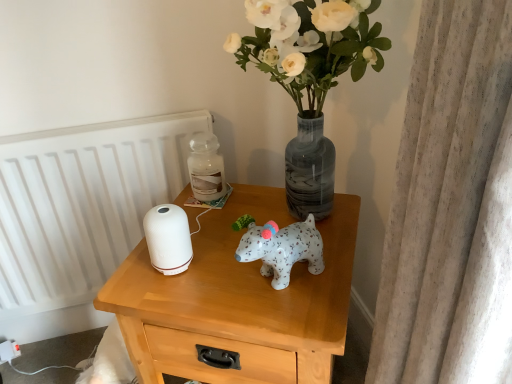
Question: Should I look upward or downward to see white glossy radiator at left?

Choices:
 (A) down
 (B) up

Answer: (A)

Question: Is white matte nightstand at center turned away from white matte vase at upper center?

Choices:
 (A) no
 (B) yes

Answer: (A)

Question: Is white matte nightstand at center oriented towards white matte vase at upper center?

Choices:
 (A) no
 (B) yes

Answer: (A)

Question: Considering the relative sizes of white matte nightstand at center and white matte vase at upper center in the image provided, is white matte nightstand at center thinner than white matte vase at upper center?

Choices:
 (A) yes
 (B) no

Answer: (B)

Question: Considering the relative sizes of white matte nightstand at center and white matte vase at upper center in the image provided, is white matte nightstand at center wider than white matte vase at upper center?

Choices:
 (A) yes
 (B) no

Answer: (A)

Question: Does white matte nightstand at center have a larger size compared to white matte vase at upper center?

Choices:
 (A) no
 (B) yes

Answer: (B)

Question: Considering the relative sizes of white matte nightstand at center and white matte vase at upper center in the image provided, is white matte nightstand at center smaller than white matte vase at upper center?

Choices:
 (A) yes
 (B) no

Answer: (B)

Question: Is white glossy radiator at left not close to white matte vase at upper center?

Choices:
 (A) no
 (B) yes

Answer: (A)

Question: Are white glossy radiator at left and white matte vase at upper center making contact?

Choices:
 (A) no
 (B) yes

Answer: (A)

Question: From a real-world perspective, is white glossy radiator at left physically below white matte vase at upper center?

Choices:
 (A) yes
 (B) no

Answer: (A)

Question: From the image's perspective, is white glossy radiator at left under white matte vase at upper center?

Choices:
 (A) yes
 (B) no

Answer: (A)

Question: Can you confirm if white glossy radiator at left is thinner than white matte vase at upper center?

Choices:
 (A) no
 (B) yes

Answer: (B)

Question: Does white glossy radiator at left appear on the left side of white matte vase at upper center?

Choices:
 (A) yes
 (B) no

Answer: (A)

Question: Is white matte nightstand at center not within white glossy radiator at left?

Choices:
 (A) no
 (B) yes

Answer: (B)